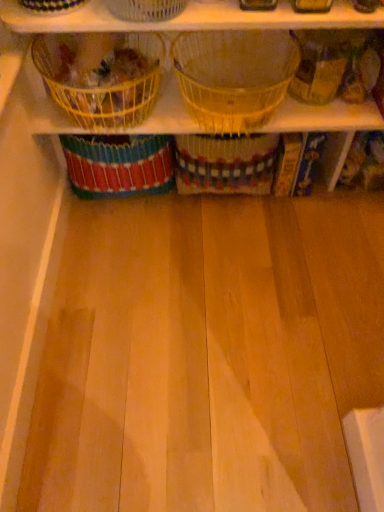
How much space does translucent plastic basket at center, the first basket positioned from the right, occupy vertically?

The height of translucent plastic basket at center, the first basket positioned from the right, is 8.24 inches.

Describe the element at coordinates (146, 9) in the screenshot. Image resolution: width=384 pixels, height=512 pixels. I see `clear plastic basket at upper center, acting as the second basket starting from the left` at that location.

Where is `yellow wire basket at upper left, which appears as the first basket when viewed from the left`? This screenshot has height=512, width=384. yellow wire basket at upper left, which appears as the first basket when viewed from the left is located at coordinates (101, 86).

How much space does yellow wire basket at upper left, which appears as the first basket when viewed from the left, occupy vertically?

It is 19.08 centimeters.

Locate an element on the screen. Image resolution: width=384 pixels, height=512 pixels. translucent plastic basket at center, the first basket positioned from the right is located at coordinates (234, 76).

Consider the image. From the image's perspective, which one is positioned higher, clear plastic basket at upper center, the 2th basket when ordered from right to left, or translucent plastic basket at center, the first basket positioned from the right?

clear plastic basket at upper center, the 2th basket when ordered from right to left, is shown above in the image.

Would you say clear plastic basket at upper center, acting as the second basket starting from the left, is a long distance from translucent plastic basket at center, which is the 3th basket in left-to-right order?

clear plastic basket at upper center, acting as the second basket starting from the left, is actually quite close to translucent plastic basket at center, which is the 3th basket in left-to-right order.

Considering the sizes of objects clear plastic basket at upper center, acting as the second basket starting from the left, and translucent plastic basket at center, which is the 3th basket in left-to-right order, in the image provided, who is smaller, clear plastic basket at upper center, acting as the second basket starting from the left, or translucent plastic basket at center, which is the 3th basket in left-to-right order,?

With smaller size is clear plastic basket at upper center, acting as the second basket starting from the left.

Is clear plastic basket at upper center, the 2th basket when ordered from right to left, in front of or behind translucent plastic basket at center, which is the 3th basket in left-to-right order, in the image?

In the image, clear plastic basket at upper center, the 2th basket when ordered from right to left, appears in front of translucent plastic basket at center, which is the 3th basket in left-to-right order.

Which object is positioned more to the left, yellow wire basket at upper left, which appears as the first basket when viewed from the left, or clear plastic basket at upper center, acting as the second basket starting from the left?

yellow wire basket at upper left, which appears as the first basket when viewed from the left.

Can you tell me how much yellow wire basket at upper left, which appears as the first basket when viewed from the left, and clear plastic basket at upper center, the 2th basket when ordered from right to left, differ in facing direction?

They differ by 36 degrees in their facing directions.

From the image's perspective, starting from the clear plastic basket at upper center, acting as the second basket starting from the left, which basket is the 2nd one below? Please provide its 2D coordinates.

[(101, 86)]

Consider the image. Is translucent plastic basket at center, which is the 3th basket in left-to-right order, further to the viewer compared to yellow wire basket at upper left, positioned as the third basket in right-to-left order?

No, the depth of translucent plastic basket at center, which is the 3th basket in left-to-right order, is less than that of yellow wire basket at upper left, positioned as the third basket in right-to-left order.

From a real-world perspective, which basket is the 1st one above the yellow wire basket at upper left, which appears as the first basket when viewed from the left? Please provide its 2D coordinates.

[(234, 76)]

Does translucent plastic basket at center, which is the 3th basket in left-to-right order, appear on the right side of yellow wire basket at upper left, positioned as the third basket in right-to-left order?

Yes, translucent plastic basket at center, which is the 3th basket in left-to-right order, is to the right of yellow wire basket at upper left, positioned as the third basket in right-to-left order.

Is translucent plastic basket at center, which is the 3th basket in left-to-right order, wider than yellow wire basket at upper left, which appears as the first basket when viewed from the left?

Indeed, translucent plastic basket at center, which is the 3th basket in left-to-right order, has a greater width compared to yellow wire basket at upper left, which appears as the first basket when viewed from the left.

Between yellow wire basket at upper left, positioned as the third basket in right-to-left order, and translucent plastic basket at center, which is the 3th basket in left-to-right order, which one is positioned in front?

translucent plastic basket at center, which is the 3th basket in left-to-right order, is in front.

From a real-world perspective, which is physically above, yellow wire basket at upper left, which appears as the first basket when viewed from the left, or translucent plastic basket at center, which is the 3th basket in left-to-right order?

From a 3D spatial view, translucent plastic basket at center, which is the 3th basket in left-to-right order, is above.

Which is closer to the camera, (85, 98) or (284, 31)?

The point (85, 98) is closer to the camera.

At what (x,y) coordinates should I click in order to perform the action: click on the 2nd basket counting from the right of the yellow wire basket at upper left, which appears as the first basket when viewed from the left. Please return your answer as a coordinate pair (x, y). The image size is (384, 512). Looking at the image, I should click on (234, 76).

In the scene shown: Considering the positions of objects clear plastic basket at upper center, the 2th basket when ordered from right to left, and yellow wire basket at upper left, positioned as the third basket in right-to-left order, in the image provided, who is behind, clear plastic basket at upper center, the 2th basket when ordered from right to left, or yellow wire basket at upper left, positioned as the third basket in right-to-left order,?

yellow wire basket at upper left, positioned as the third basket in right-to-left order, is further from the camera.

Is clear plastic basket at upper center, acting as the second basket starting from the left, facing towards yellow wire basket at upper left, which appears as the first basket when viewed from the left?

No, clear plastic basket at upper center, acting as the second basket starting from the left, is not oriented towards yellow wire basket at upper left, which appears as the first basket when viewed from the left.

Choose the correct answer: Is clear plastic basket at upper center, the 2th basket when ordered from right to left, inside yellow wire basket at upper left, which appears as the first basket when viewed from the left, or outside it?

clear plastic basket at upper center, the 2th basket when ordered from right to left, is spatially situated outside yellow wire basket at upper left, which appears as the first basket when viewed from the left.

How many degrees apart are the facing directions of clear plastic basket at upper center, the 2th basket when ordered from right to left, and yellow wire basket at upper left, positioned as the third basket in right-to-left order?

There is a 36-degree angle between the facing directions of clear plastic basket at upper center, the 2th basket when ordered from right to left, and yellow wire basket at upper left, positioned as the third basket in right-to-left order.

Based on the photo, based on their sizes in the image, would you say translucent plastic basket at center, which is the 3th basket in left-to-right order, is bigger or smaller than clear plastic basket at upper center, acting as the second basket starting from the left?

Clearly, translucent plastic basket at center, which is the 3th basket in left-to-right order, is larger in size than clear plastic basket at upper center, acting as the second basket starting from the left.

Which is in front, translucent plastic basket at center, the first basket positioned from the right, or clear plastic basket at upper center, the 2th basket when ordered from right to left?

clear plastic basket at upper center, the 2th basket when ordered from right to left, is closer to the camera.

How different are the orientations of translucent plastic basket at center, which is the 3th basket in left-to-right order, and clear plastic basket at upper center, the 2th basket when ordered from right to left, in degrees?

The facing directions of translucent plastic basket at center, which is the 3th basket in left-to-right order, and clear plastic basket at upper center, the 2th basket when ordered from right to left, are 36 degrees apart.

Considering the positions of point (285, 78) and point (137, 10), is point (285, 78) closer or farther from the camera than point (137, 10)?

Point (285, 78) is farther from the camera than point (137, 10).

Locate an element on the screen. This screenshot has height=512, width=384. the 1st basket to the left when counting from the translucent plastic basket at center, which is the 3th basket in left-to-right order is located at coordinates (146, 9).

Identify the location of basket that is the 2nd object directly below the clear plastic basket at upper center, acting as the second basket starting from the left (from a real-world perspective). This screenshot has width=384, height=512. (101, 86).

Considering their positions, is yellow wire basket at upper left, which appears as the first basket when viewed from the left, positioned closer to clear plastic basket at upper center, the 2th basket when ordered from right to left, than translucent plastic basket at center, which is the 3th basket in left-to-right order?

The object closer to clear plastic basket at upper center, the 2th basket when ordered from right to left, is yellow wire basket at upper left, which appears as the first basket when viewed from the left.

Estimate the real-world distances between objects in this image. Which object is closer to translucent plastic basket at center, which is the 3th basket in left-to-right order, yellow wire basket at upper left, positioned as the third basket in right-to-left order, or clear plastic basket at upper center, acting as the second basket starting from the left?

The object closer to translucent plastic basket at center, which is the 3th basket in left-to-right order, is yellow wire basket at upper left, positioned as the third basket in right-to-left order.

Based on their spatial positions, is translucent plastic basket at center, the first basket positioned from the right, or yellow wire basket at upper left, positioned as the third basket in right-to-left order, closer to clear plastic basket at upper center, acting as the second basket starting from the left?

A: yellow wire basket at upper left, positioned as the third basket in right-to-left order.

Based on their spatial positions, is clear plastic basket at upper center, acting as the second basket starting from the left, or translucent plastic basket at center, the first basket positioned from the right, further from yellow wire basket at upper left, which appears as the first basket when viewed from the left?

translucent plastic basket at center, the first basket positioned from the right, lies further to yellow wire basket at upper left, which appears as the first basket when viewed from the left, than the other object.

Estimate the real-world distances between objects in this image. Which object is closer to translucent plastic basket at center, which is the 3th basket in left-to-right order, clear plastic basket at upper center, the 2th basket when ordered from right to left, or yellow wire basket at upper left, which appears as the first basket when viewed from the left?

The object closer to translucent plastic basket at center, which is the 3th basket in left-to-right order, is yellow wire basket at upper left, which appears as the first basket when viewed from the left.

Estimate the real-world distances between objects in this image. Which object is closer to yellow wire basket at upper left, positioned as the third basket in right-to-left order, translucent plastic basket at center, the first basket positioned from the right, or clear plastic basket at upper center, acting as the second basket starting from the left?

The object closer to yellow wire basket at upper left, positioned as the third basket in right-to-left order, is clear plastic basket at upper center, acting as the second basket starting from the left.

Identify the location of basket between yellow wire basket at upper left, which appears as the first basket when viewed from the left, and translucent plastic basket at center, which is the 3th basket in left-to-right order, from left to right. [146, 9].